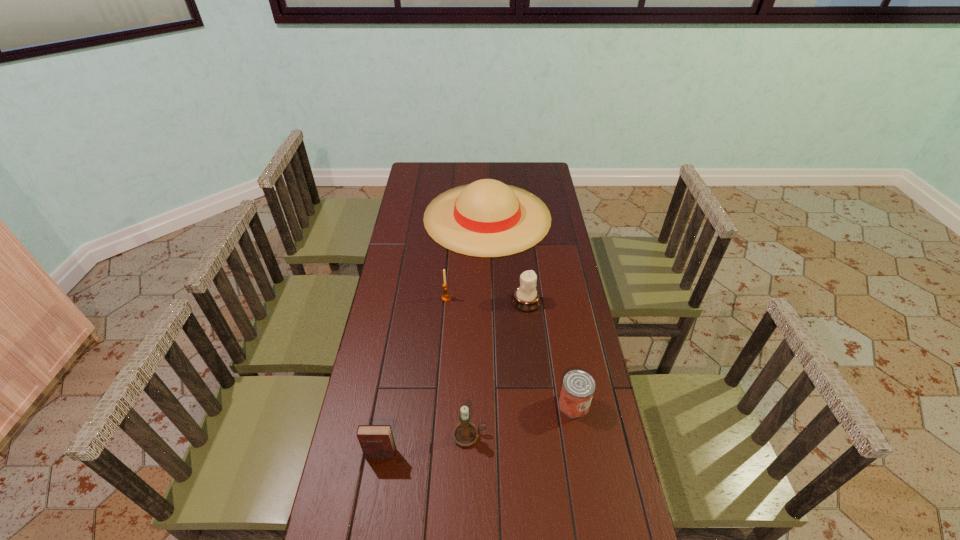
I want to click on sombrero, so click(x=487, y=218).

The height and width of the screenshot is (540, 960). Identify the location of the tallest object. (487, 218).

The width and height of the screenshot is (960, 540). I want to click on the leftmost candle holder, so click(445, 297).

Find the location of a particular element. Image resolution: width=960 pixels, height=540 pixels. the rightmost candle holder is located at coordinates (526, 298).

Locate an element on the screen. The image size is (960, 540). the second candle holder from right to left is located at coordinates (465, 433).

Identify the location of the second nearest object. (465, 433).

At what (x,y) coordinates should I click in order to perform the action: click on diary. Please return your answer as a coordinate pair (x, y). The image size is (960, 540). Looking at the image, I should click on (377, 442).

At what (x,y) coordinates should I click in order to perform the action: click on the third nearest object. Please return your answer as a coordinate pair (x, y). This screenshot has width=960, height=540. Looking at the image, I should click on (578, 387).

I want to click on can, so click(578, 387).

Locate an element on the screen. Image resolution: width=960 pixels, height=540 pixels. vacant space located on the left of the sombrero is located at coordinates (402, 217).